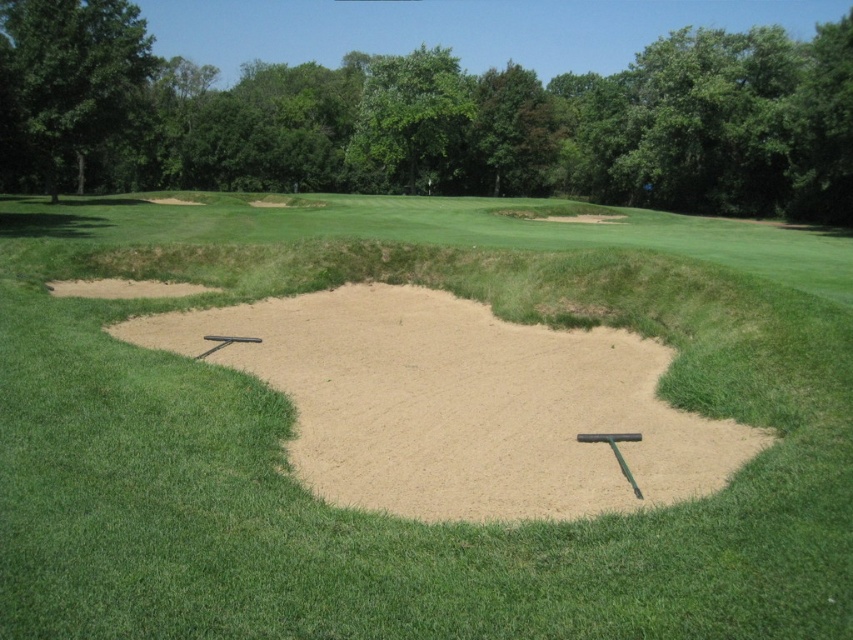
Question: Does smooth sand trap at center have a greater width compared to smooth sand at center?

Choices:
 (A) no
 (B) yes

Answer: (B)

Question: Which point is closer to the camera?

Choices:
 (A) smooth sand trap at center
 (B) smooth sand at center

Answer: (A)

Question: Among these objects, which one is nearest to the camera?

Choices:
 (A) smooth sand trap at center
 (B) smooth sand at center

Answer: (A)

Question: Can you confirm if smooth sand trap at center is positioned below smooth sand at center?

Choices:
 (A) no
 (B) yes

Answer: (A)

Question: Is smooth sand trap at center positioned behind smooth sand at center?

Choices:
 (A) no
 (B) yes

Answer: (A)

Question: Which point is closer to the camera?

Choices:
 (A) (524, 442)
 (B) (132, 592)

Answer: (B)